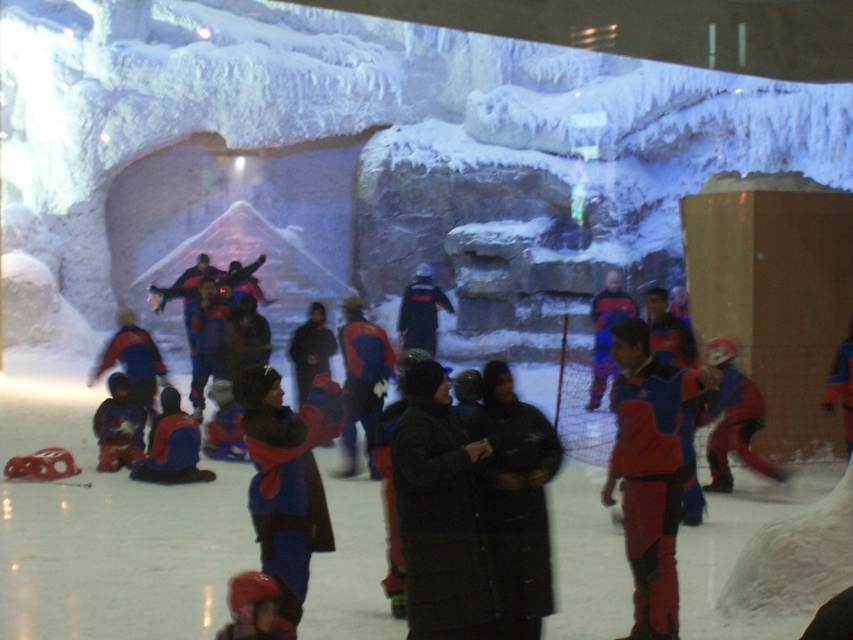
Question: Which object is positioned closest to the matte blue jacket at lower left?

Choices:
 (A) matte blue snowsuit at lower left
 (B) matte red helmet at lower left
 (C) matte blue ski suit at center

Answer: (A)

Question: Can you confirm if matte blue ski suit at center is positioned to the left of matte blue snowsuit at lower left?

Choices:
 (A) yes
 (B) no

Answer: (B)

Question: Does matte blue jacket at lower left appear over matte red helmet at lower left?

Choices:
 (A) yes
 (B) no

Answer: (A)

Question: Which of the following is the farthest from the observer?

Choices:
 (A) matte blue ski suit at center
 (B) matte red helmet at lower left

Answer: (A)

Question: Which point appears farthest from the camera in this image?

Choices:
 (A) (113, 426)
 (B) (300, 444)
 (C) (173, 470)
 (D) (248, 636)

Answer: (A)

Question: Is matte blue jacket at lower left positioned before matte blue snowsuit at lower left?

Choices:
 (A) no
 (B) yes

Answer: (B)